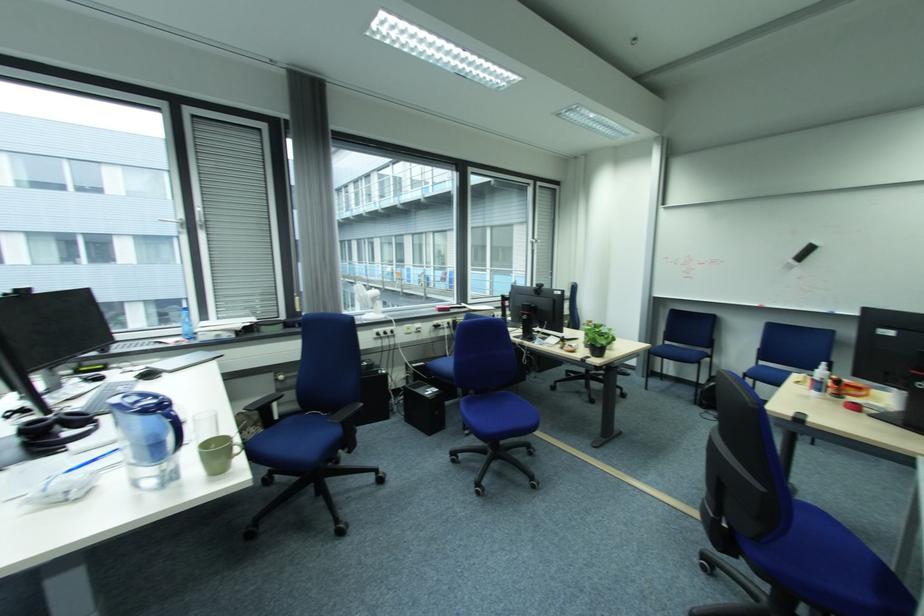
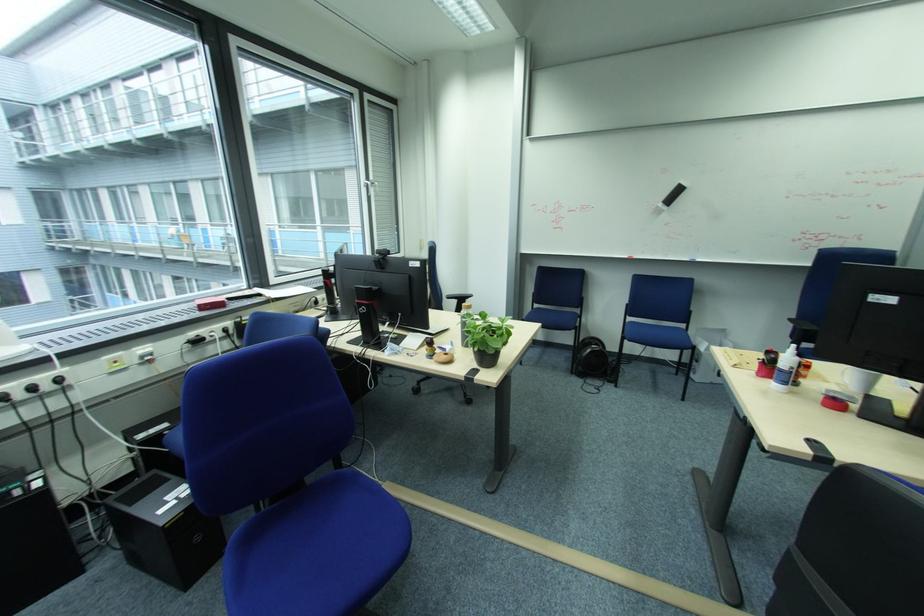
Question: What movement of the cameraman would produce the second image?

Choices:
 (A) Left
 (B) Right
 (C) Forward
 (D) Backward

Answer: (C)